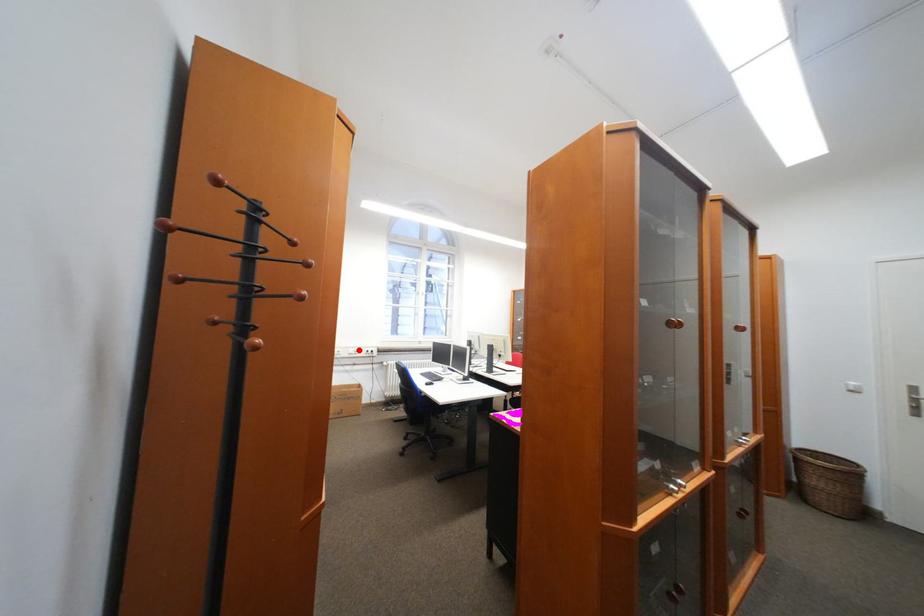
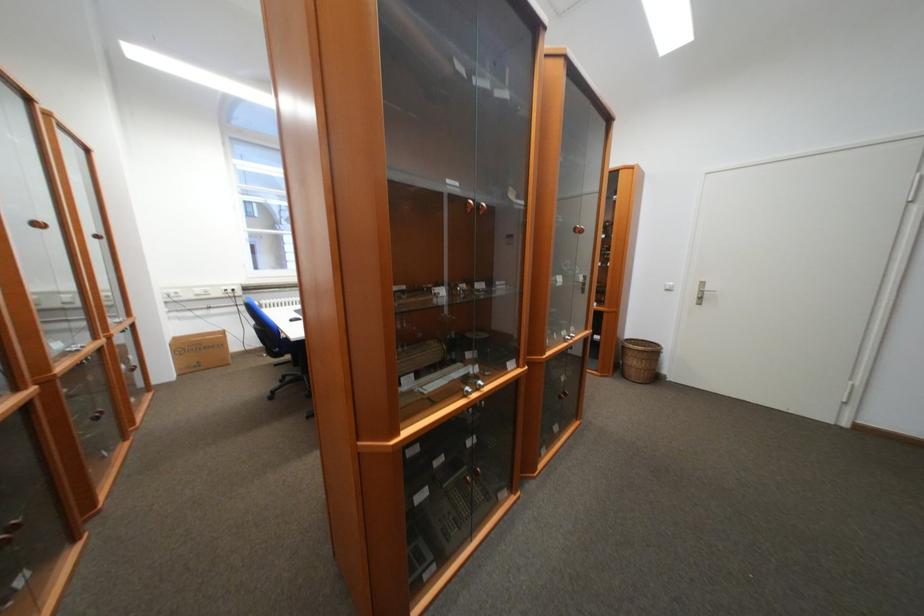
Find the pixel in the second image that matches the highlighted location in the first image.

(203, 290)